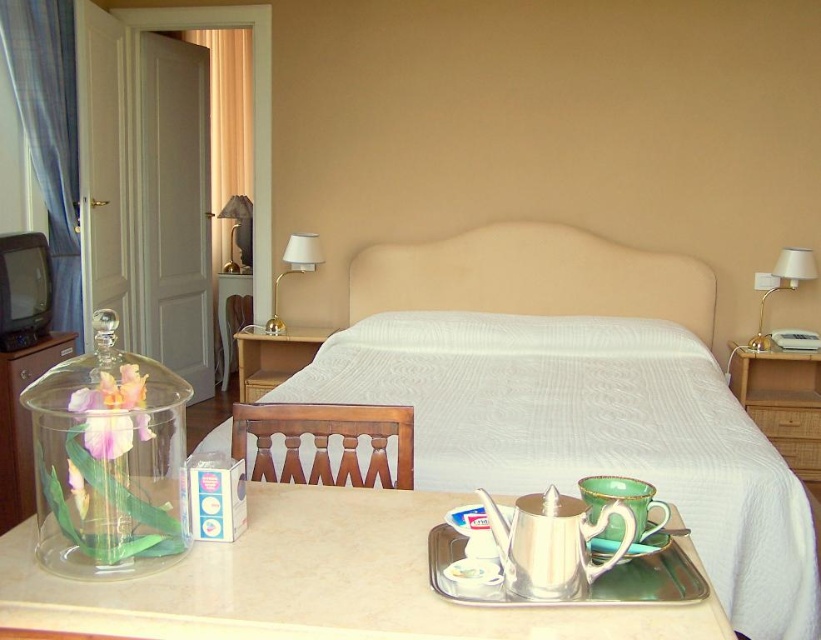
You are standing in the hotel room and want to place a small decorative item on the bed. The bed is located at the center of the room. Can you confirm if the point at coordinates (576, 394) is on the bed?

Yes, the point at coordinates (576, 394) is on the white fabric bed at center.

You are a hotel guest who wants to place a decorative pillow on the bed. Considering the size of the white fabric bed at center and the metallic gold lampshade at upper center, which object should you place the pillow on to ensure it stays centered?

The white fabric bed at center is wider than the metallic gold lampshade at upper center, so placing the decorative pillow on the white fabric bed at center will ensure it stays centered.

You are a guest in the hotel room and want to place your phone on the closest object to the bed. Which object should you choose between the white textured pillow at center and the metallic gold lampshade at upper center?

The white textured pillow at center is below the metallic gold lampshade at upper center, so the pillow is closer to the bed. You should place your phone on the white textured pillow at center.